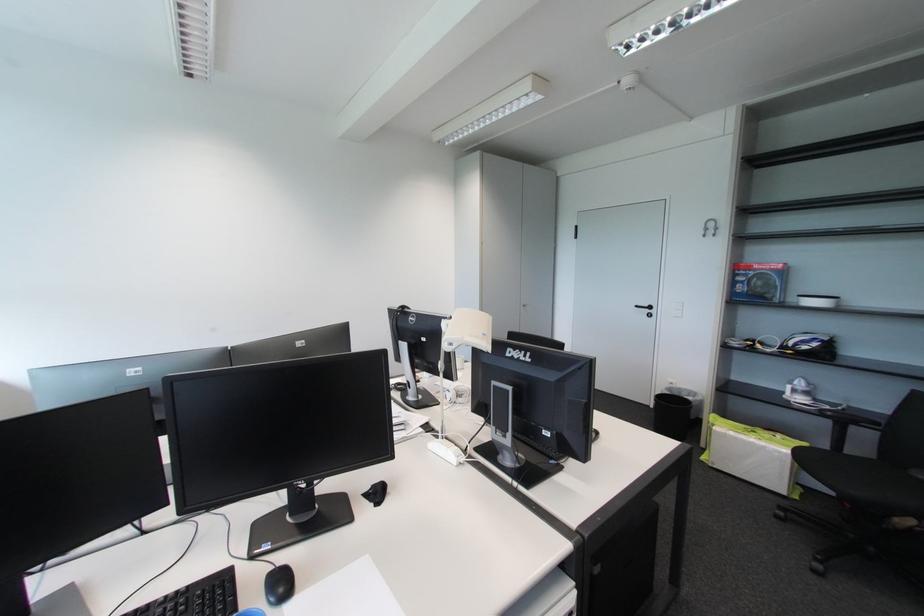
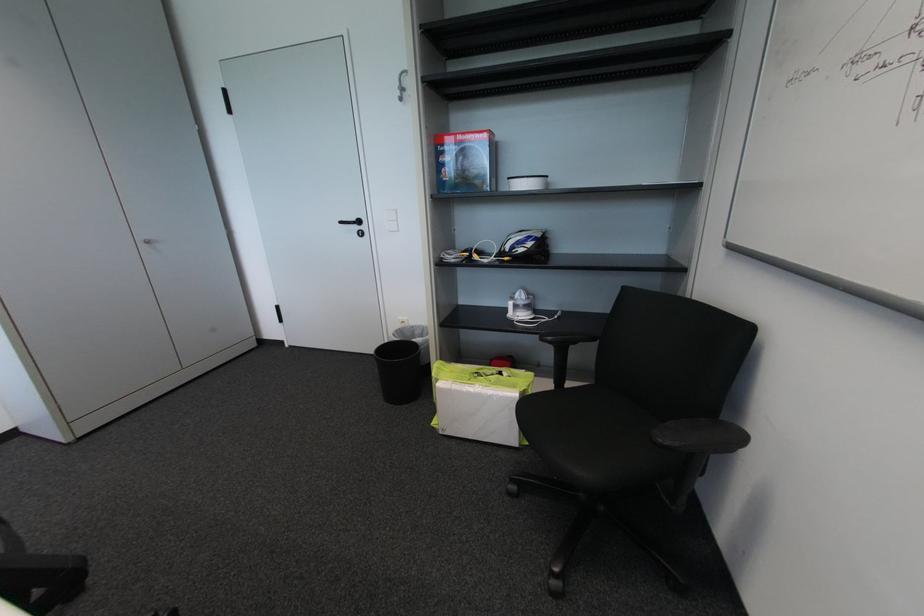
Find the pixel in the second image that matches point 653,312 in the first image.

(362, 229)